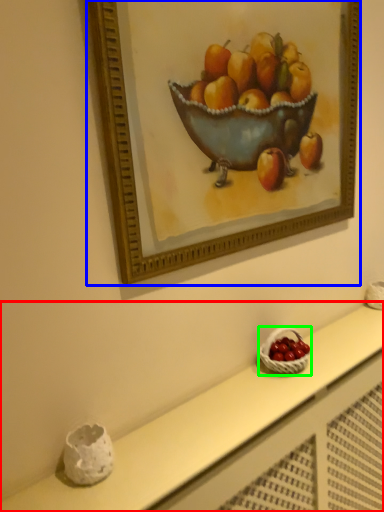
Question: Which is nearer to the table (highlighted by a red box)? picture frame (highlighted by a blue box) or basket (highlighted by a green box).

Choices:
 (A) picture frame
 (B) basket

Answer: (B)